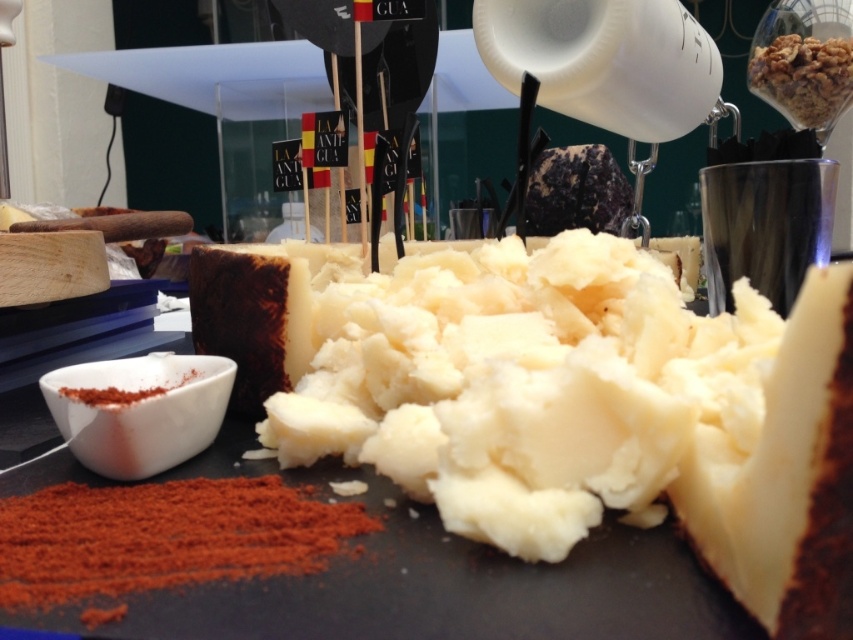
Question: Is the position of white creamy cheese at center less distant than that of crumbly brown nuts at upper right?

Choices:
 (A) yes
 (B) no

Answer: (A)

Question: Which object is closer to the camera taking this photo?

Choices:
 (A) red powder at lower left
 (B) white creamy cheese at center
 (C) crumbly brown nuts at upper right

Answer: (B)

Question: Which point appears farthest from the camera in this image?

Choices:
 (A) (825, 104)
 (B) (186, 378)

Answer: (A)

Question: From the image, what is the correct spatial relationship of crumbly brown nuts at upper right in relation to red powder at lower left?

Choices:
 (A) above
 (B) below

Answer: (A)

Question: Can you confirm if crumbly brown nuts at upper right is smaller than red powder at lower left?

Choices:
 (A) no
 (B) yes

Answer: (A)

Question: Among these points, which one is nearest to the camera?

Choices:
 (A) click(x=119, y=388)
 (B) click(x=843, y=24)
 (C) click(x=317, y=385)

Answer: (C)